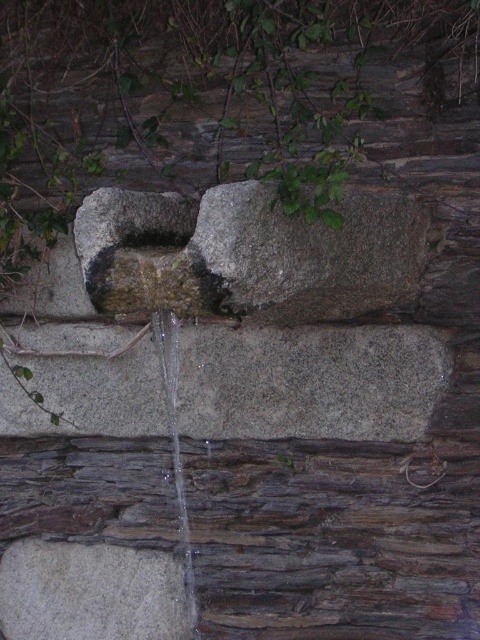
Question: Estimate the real-world distances between objects in this image. Which object is farther from the gray stone at center?

Choices:
 (A) clear glass water at lower center
 (B) gray rough stone at lower left
 (C) gray rough stone at center

Answer: (B)

Question: Is gray rough stone at center wider than gray rough stone at lower left?

Choices:
 (A) no
 (B) yes

Answer: (B)

Question: Can you confirm if gray stone at center is positioned to the right of gray rough stone at center?

Choices:
 (A) yes
 (B) no

Answer: (B)

Question: Which object is closer to the camera taking this photo?

Choices:
 (A) gray stone at center
 (B) gray rough stone at center
 (C) gray rough stone at lower left

Answer: (B)

Question: Is gray rough stone at center above gray rough stone at lower left?

Choices:
 (A) yes
 (B) no

Answer: (A)

Question: Which point is closer to the camera?

Choices:
 (A) clear glass water at lower center
 (B) gray rough stone at center
 (C) gray stone at center
 (D) gray rough stone at lower left

Answer: (B)